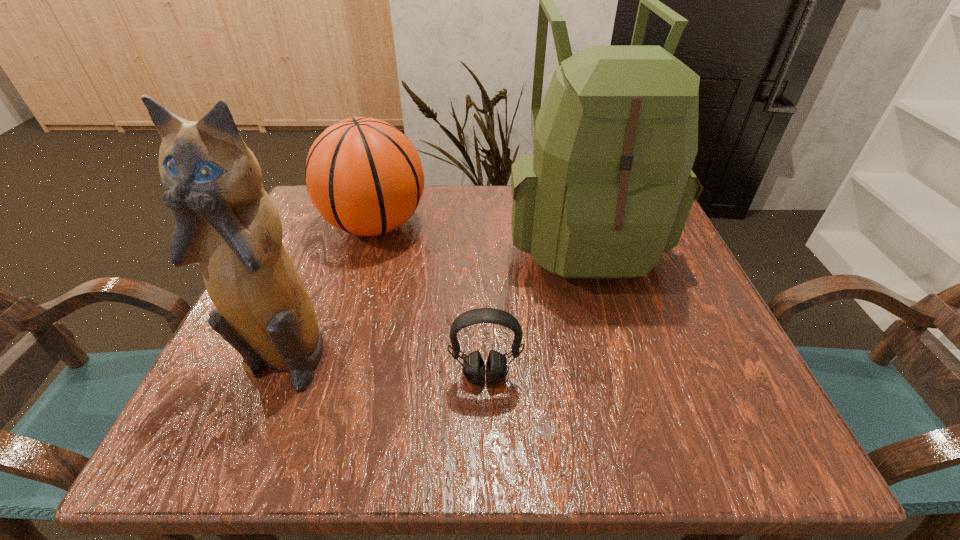
At what (x,y) coordinates should I click in order to perform the action: click on cat located in the left edge section of the desktop. Please return your answer as a coordinate pair (x, y). Looking at the image, I should click on (226, 223).

Locate an element on the screen. The image size is (960, 540). basketball that is at the left edge is located at coordinates (364, 176).

The image size is (960, 540). In order to click on object situated at the right edge in this screenshot , I will do `click(608, 189)`.

Find the location of a particular element. object present at the far left corner is located at coordinates (364, 176).

Where is `object located at the far right corner`? object located at the far right corner is located at coordinates (608, 189).

Identify the location of free region at the far edge of the desktop. (432, 233).

You are a GUI agent. You are given a task and a screenshot of the screen. Output one action in this format:
    pyautogui.click(x=<x>, y=<y>)
    Task: Click on the vacant space at the near edge of the desktop
    This screenshot has height=540, width=960.
    Given the screenshot: What is the action you would take?
    [x=564, y=421]

Locate an element on the screen. This screenshot has width=960, height=540. vacant region at the left edge of the desktop is located at coordinates (334, 293).

In order to click on vacant space at the right edge of the desktop in this screenshot , I will do pos(649,274).

What are the coordinates of `free location at the far left corner of the desktop` in the screenshot? It's located at (309, 237).